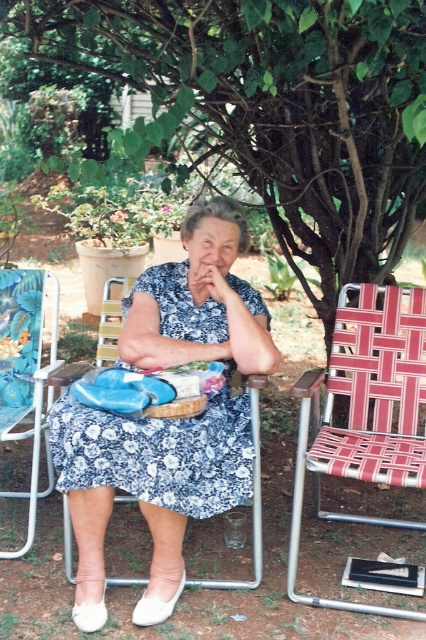
The height and width of the screenshot is (640, 426). What do you see at coordinates (365, 410) in the screenshot?
I see `red woven fabric folding chair at right` at bounding box center [365, 410].

This screenshot has width=426, height=640. In order to click on red woven fabric folding chair at right in this screenshot , I will do `click(365, 410)`.

Where is `red woven fabric folding chair at right`? red woven fabric folding chair at right is located at coordinates (365, 410).

Does green leafy tree at upper center lie in front of blue floral dress at center?

Yes, it is.

Does green leafy tree at upper center have a lesser height compared to blue floral dress at center?

No, green leafy tree at upper center is not shorter than blue floral dress at center.

What are the coordinates of `green leafy tree at upper center` in the screenshot? It's located at (273, 108).

Looking at this image, can you confirm if green leafy tree at upper center is shorter than blue fabric folding chair at left?

No, green leafy tree at upper center is not shorter than blue fabric folding chair at left.

Is point (250, 52) farther from viewer compared to point (6, 320)?

No.

Is point (267, 12) positioned in front of point (2, 301)?

Yes, it is in front of point (2, 301).

Where is `green leafy tree at upper center`? The height and width of the screenshot is (640, 426). green leafy tree at upper center is located at coordinates (273, 108).